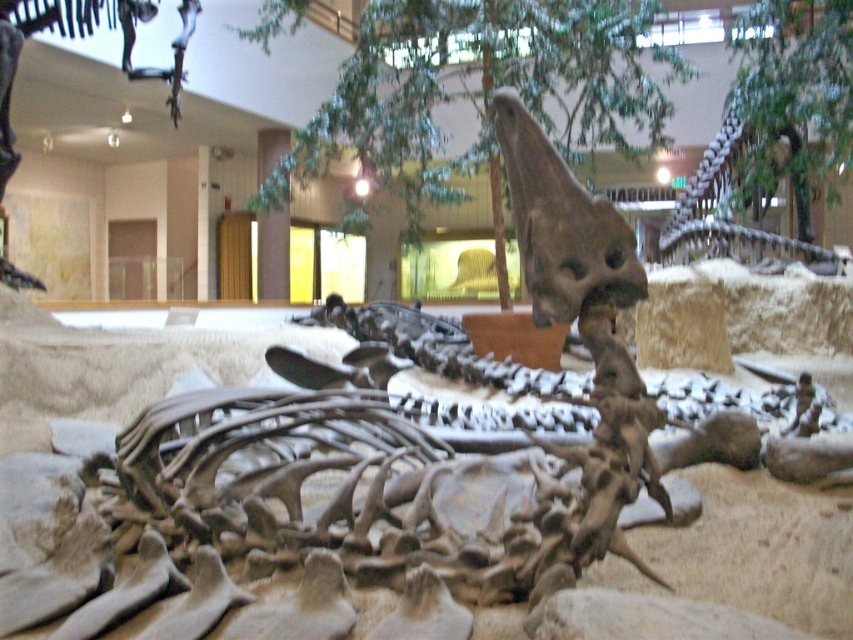
Who is positioned more to the right, gray bone-like skull at center or matte gray dinosaur skeleton at upper left?

gray bone-like skull at center is more to the right.

What do you see at coordinates (584, 323) in the screenshot? Image resolution: width=853 pixels, height=640 pixels. I see `gray bone-like skull at center` at bounding box center [584, 323].

Identify the location of gray bone-like skull at center. The height and width of the screenshot is (640, 853). (584, 323).

The width and height of the screenshot is (853, 640). Identify the location of gray bone-like skull at center. (584, 323).

Does gray bone-like skull at center appear on the right side of gray bone-like dinosaur at upper right?

In fact, gray bone-like skull at center is to the left of gray bone-like dinosaur at upper right.

Which is in front, point (587, 340) or point (698, 252)?

Point (587, 340)

This screenshot has height=640, width=853. I want to click on gray bone-like skull at center, so click(584, 323).

Does point (32, 10) come farther from viewer compared to point (705, 225)?

No, it is in front of (705, 225).

Locate an element on the screen. Image resolution: width=853 pixels, height=640 pixels. matte gray dinosaur skeleton at upper left is located at coordinates [x=80, y=36].

Locate an element on the screen. matte gray dinosaur skeleton at upper left is located at coordinates (80, 36).

What are the coordinates of `matte gray dinosaur skeleton at upper left` in the screenshot? It's located at (80, 36).